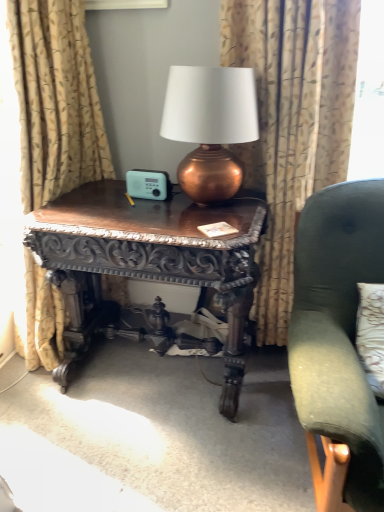
Image resolution: width=384 pixels, height=512 pixels. What are the coordinates of `empty space that is ontop of dark wood carved table at center (from a real-world perspective)` in the screenshot? It's located at (154, 206).